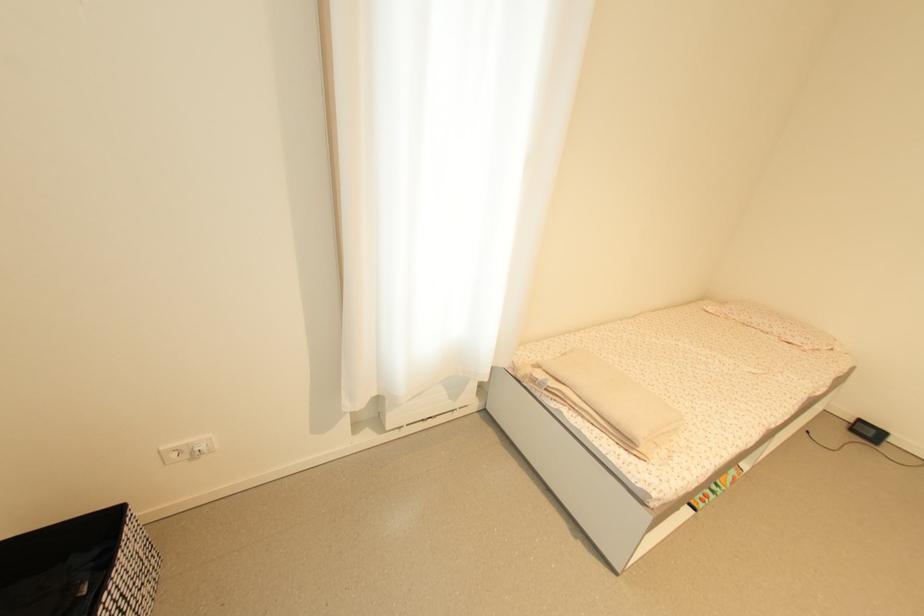
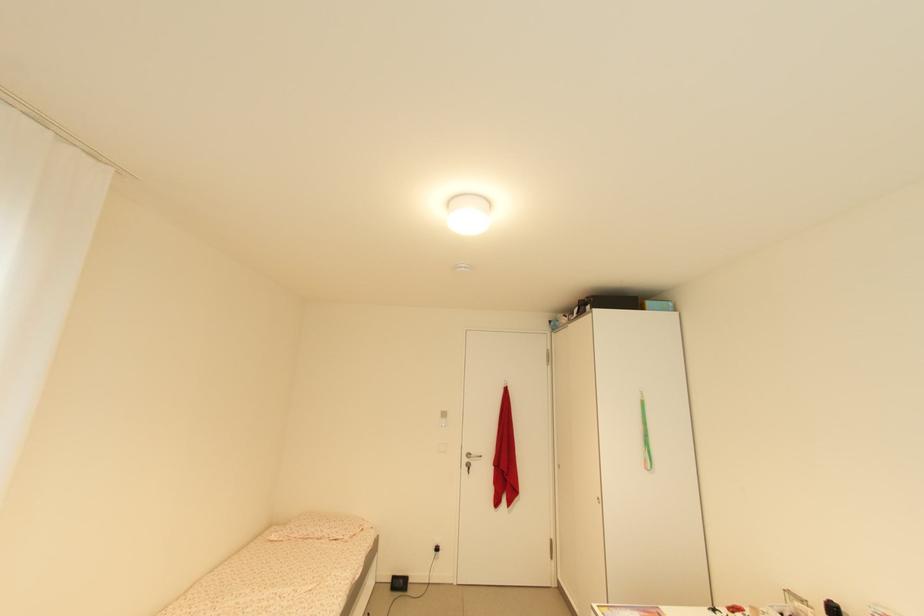
The point at (781, 334) is marked in the first image. Where is the corresponding point in the second image?

(332, 538)